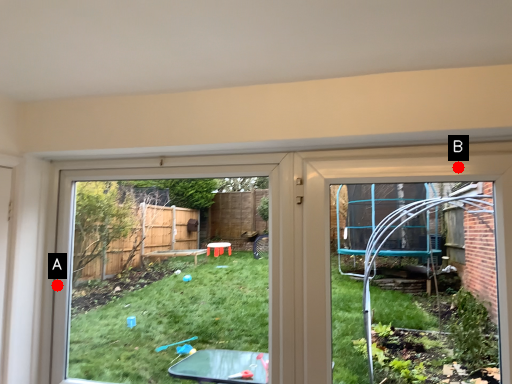
Question: Two points are circled on the image, labeled by A and B beside each circle. Which point appears farthest from the camera in this image?

Choices:
 (A) A is further
 (B) B is further

Answer: (A)